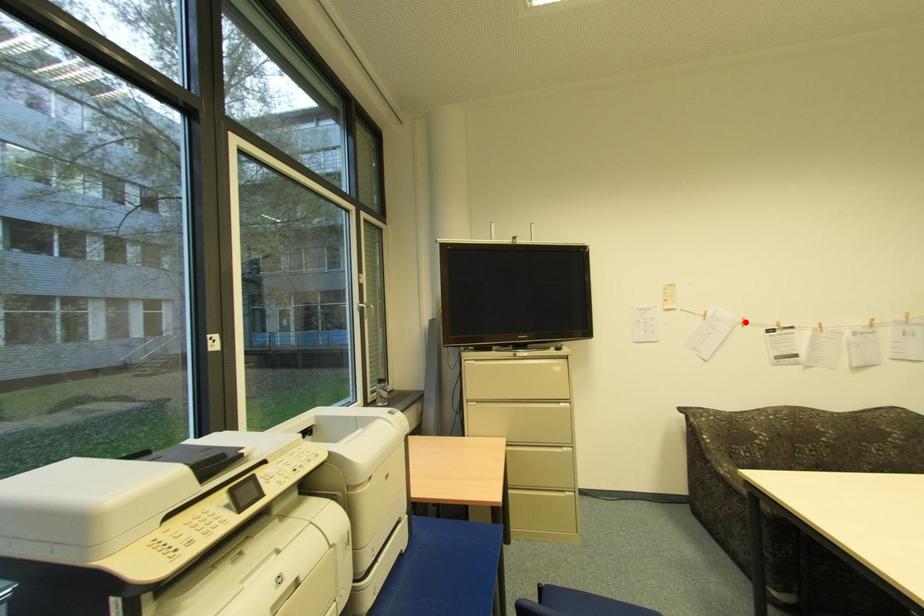
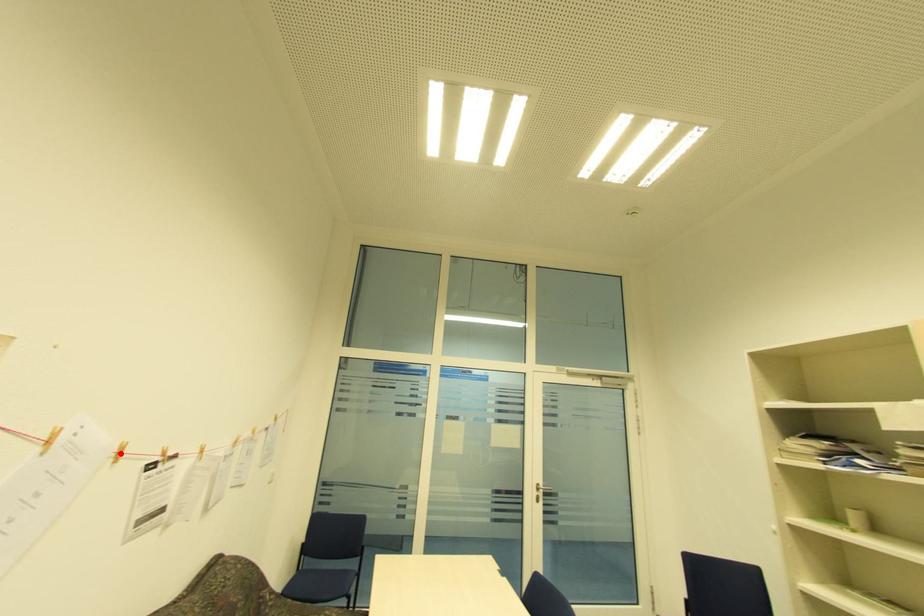
I am providing you with two images of the same scene from different viewpoints. A red point is marked on the first image and another point is marked on the second image. Is the marked point in image1 the same physical position as the marked point in image2?

Yes